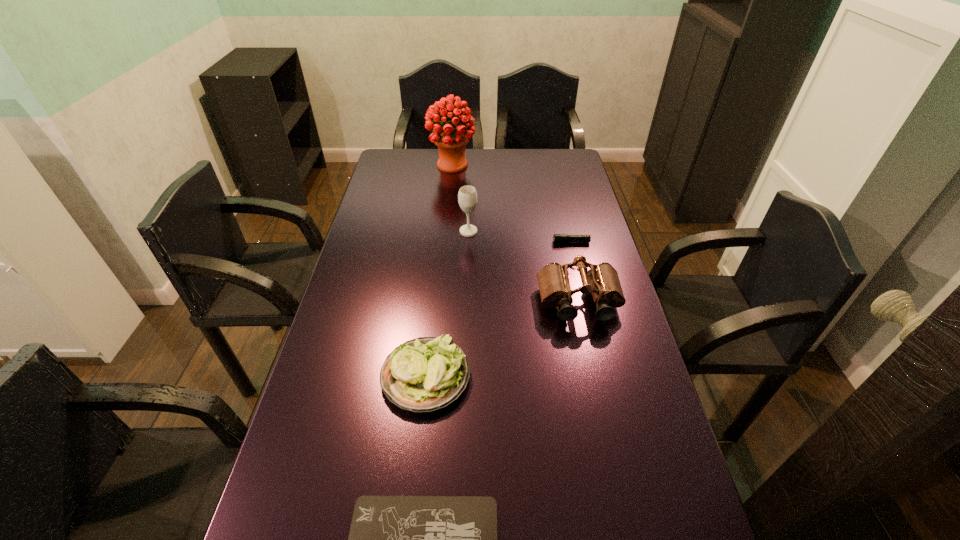
The width and height of the screenshot is (960, 540). I want to click on bouquet, so click(x=451, y=141).

This screenshot has height=540, width=960. Find the location of `the tallest object`. the tallest object is located at coordinates (451, 141).

At what (x,y) coordinates should I click in order to perform the action: click on the fifth nearest object. Please return your answer as a coordinate pair (x, y). Looking at the image, I should click on (467, 196).

The image size is (960, 540). Find the location of `the second tallest object`. the second tallest object is located at coordinates (467, 196).

I want to click on the third tallest object, so click(602, 280).

At what (x,y) coordinates should I click in order to perform the action: click on the third nearest object. Please return your answer as a coordinate pair (x, y). Looking at the image, I should click on (602, 280).

Locate an element on the screen. The width and height of the screenshot is (960, 540). the third shortest object is located at coordinates (425, 374).

This screenshot has width=960, height=540. I want to click on lettuce, so click(x=425, y=374).

The height and width of the screenshot is (540, 960). I want to click on flashlight, so click(557, 238).

The image size is (960, 540). What are the coordinates of `free point located 0.120m on the left of the tallest object` in the screenshot? It's located at (399, 165).